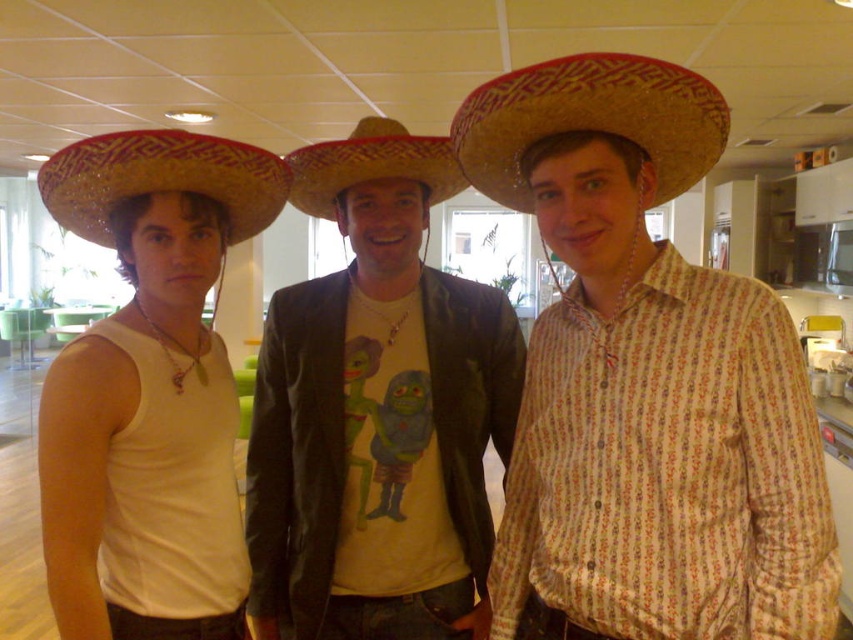
You are a photographer trying to arrange the matte straw sombrero at left and the bright straw sombrero at left for a photo shoot. Since you want to emphasize the size difference between the two, which sombrero should be placed closer to the camera to make it appear larger?

The matte straw sombrero at left should be placed closer to the camera to emphasize its larger size compared to the bright straw sombrero at left.

You are a photographer adjusting your camera settings. You need to focus on the matte brown leather jacket at center and the matte straw sombrero at left. Which object should you adjust your focus to first if you want to capture both in sharp detail?

The matte brown leather jacket at center is closer to the viewer than the matte straw sombrero at left. To capture both in sharp detail, you should focus on the matte brown leather jacket at center first, as it is closer, and the depth of field may naturally include the farther matte straw sombrero at left.